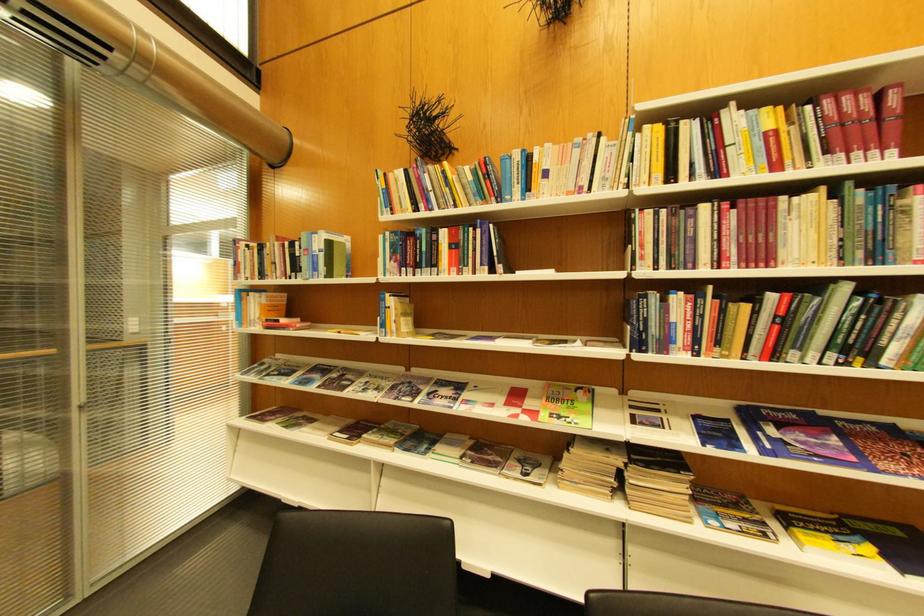
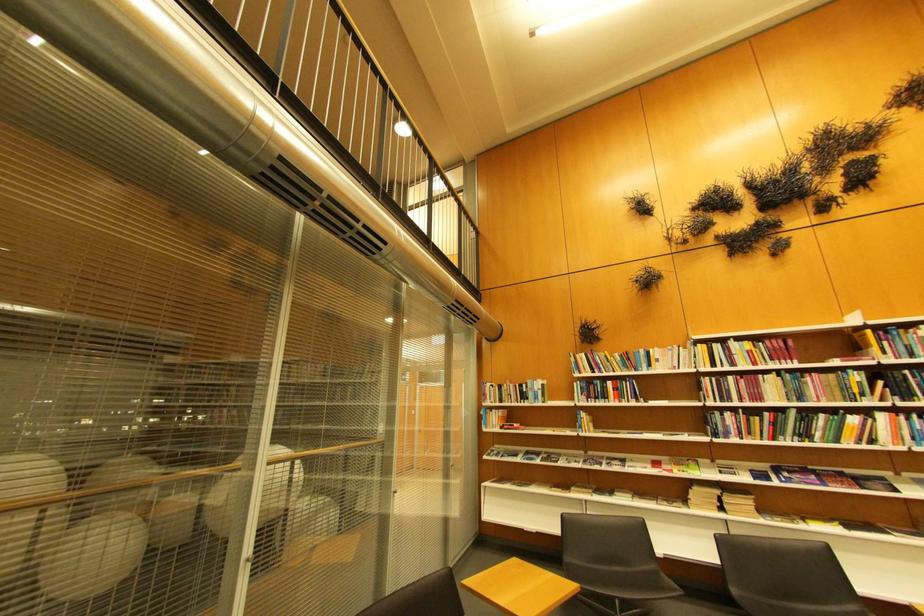
In the second image, find the point that corresponds to (x=361, y=394) in the first image.

(572, 464)